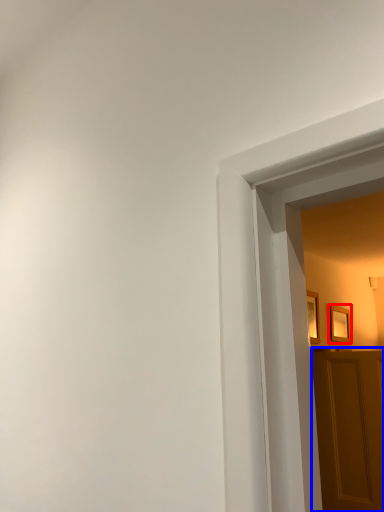
Question: Among these objects, which one is farthest to the camera, picture frame (highlighted by a red box) or door (highlighted by a blue box)?

Choices:
 (A) picture frame
 (B) door

Answer: (A)